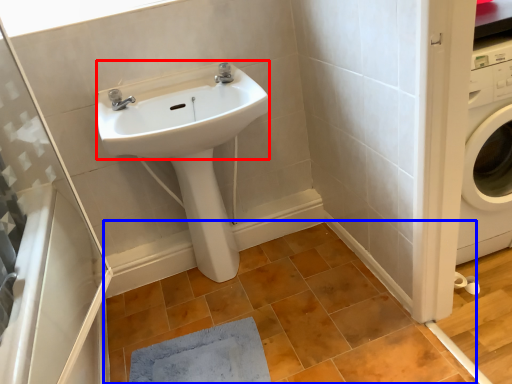
Question: Which of the following is the farthest to the observer, sink (highlighted by a red box) or tile (highlighted by a blue box)?

Choices:
 (A) sink
 (B) tile

Answer: (A)